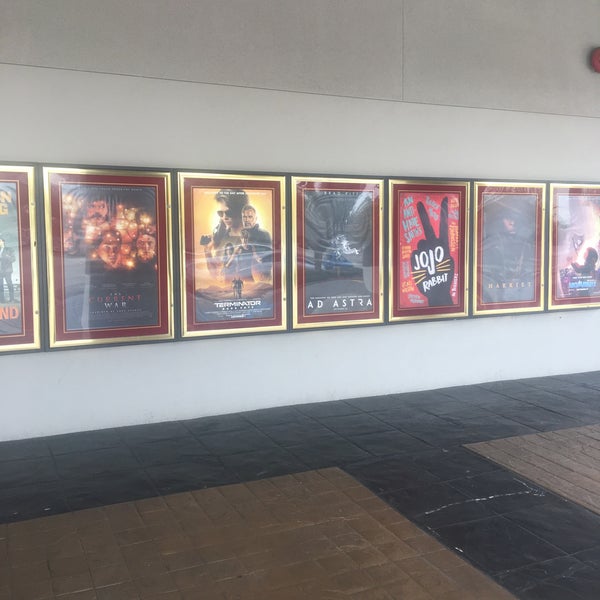
Identify the location of poster. (505, 305).